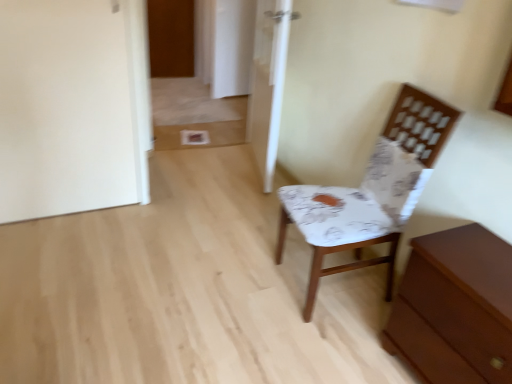
Question: Is white glossy door at center, placed as the second door when sorted from top to bottom, completely or partially inside wooden door at upper left, which is counted as the 1th door, starting from the top?

Choices:
 (A) no
 (B) yes

Answer: (A)

Question: Does wooden door at upper left, arranged as the first door when viewed from the back, have a greater width compared to white glossy door at center, which appears as the 1th door when viewed from the front?

Choices:
 (A) no
 (B) yes

Answer: (A)

Question: Does wooden door at upper left, acting as the first door starting from the left, have a greater height compared to white glossy door at center, which appears as the 1th door when viewed from the front?

Choices:
 (A) yes
 (B) no

Answer: (B)

Question: Is wooden door at upper left, arranged as the first door when viewed from the back, to the left of white glossy door at center, which appears as the 1th door when viewed from the front, from the viewer's perspective?

Choices:
 (A) yes
 (B) no

Answer: (A)

Question: Is wooden door at upper left, arranged as the first door when viewed from the back, further to the viewer compared to white glossy door at center, which appears as the 1th door when viewed from the front?

Choices:
 (A) yes
 (B) no

Answer: (A)

Question: Looking at their shapes, would you say white glossy door at center, which is the second door in left-to-right order, is wider or thinner than wooden door at upper left, acting as the first door starting from the left?

Choices:
 (A) wide
 (B) thin

Answer: (A)

Question: Does point (281, 24) appear closer or farther from the camera than point (159, 74)?

Choices:
 (A) closer
 (B) farther

Answer: (A)

Question: From their relative heights in the image, would you say white glossy door at center, which appears as the 1th door when viewed from the front, is taller or shorter than wooden door at upper left, which is counted as the 2th door, starting from the front?

Choices:
 (A) tall
 (B) short

Answer: (A)

Question: From the image's perspective, relative to wooden door at upper left, which is counted as the 2th door, starting from the right, is white glossy door at center, placed as the 1th door when sorted from right to left, above or below?

Choices:
 (A) above
 (B) below

Answer: (B)

Question: Considering the positions of brown wooden chest of drawers at lower right and white glossy door at center, the 2th door when ordered from back to front, in the image, is brown wooden chest of drawers at lower right wider or thinner than white glossy door at center, the 2th door when ordered from back to front,?

Choices:
 (A) wide
 (B) thin

Answer: (A)

Question: Considering their positions, is brown wooden chest of drawers at lower right located in front of or behind white glossy door at center, arranged as the 1th door when ordered from the bottom?

Choices:
 (A) behind
 (B) front

Answer: (B)

Question: In terms of height, does brown wooden chest of drawers at lower right look taller or shorter compared to white glossy door at center, placed as the 1th door when sorted from right to left?

Choices:
 (A) tall
 (B) short

Answer: (B)

Question: From a real-world perspective, is brown wooden chest of drawers at lower right above or below white glossy door at center, placed as the 1th door when sorted from right to left?

Choices:
 (A) above
 (B) below

Answer: (B)

Question: Is point (260, 76) closer or farther from the camera than point (490, 258)?

Choices:
 (A) farther
 (B) closer

Answer: (A)

Question: Is white glossy door at center, placed as the second door when sorted from top to bottom, in front of or behind brown wooden chest of drawers at lower right in the image?

Choices:
 (A) front
 (B) behind

Answer: (B)